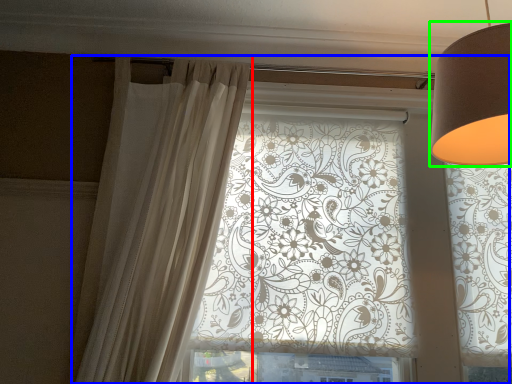
Question: Which object is the closest to the curtain (highlighted by a red box)? Choose among these: window (highlighted by a blue box) or lamp (highlighted by a green box).

Choices:
 (A) window
 (B) lamp

Answer: (A)